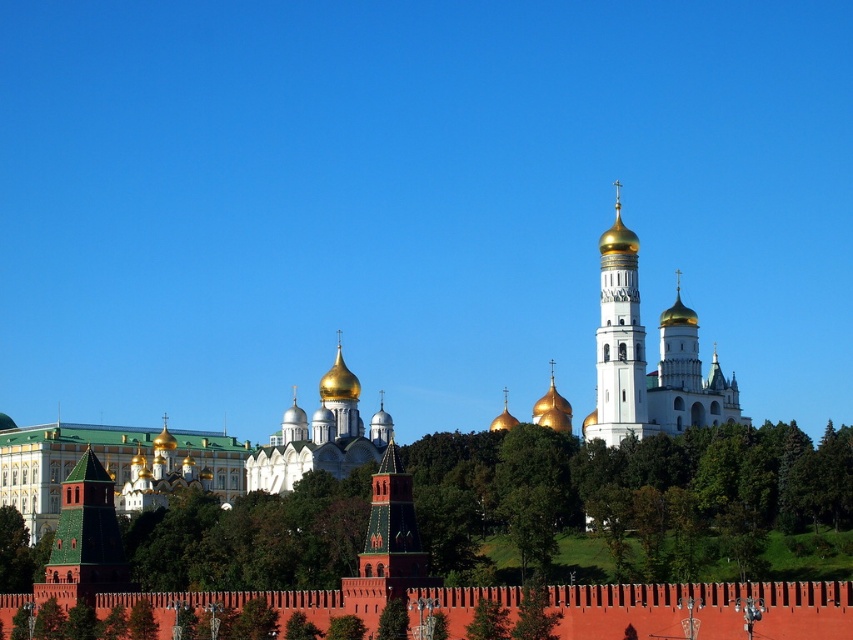
Is the position of green tiled tower at center less distant than that of green leafy tree at center?

That is False.

Does point (393, 492) lie in front of point (405, 616)?

No, it is not.

Find the location of a particular element. green tiled tower at center is located at coordinates click(393, 529).

Does point (61, 592) come behind point (404, 504)?

Yes, point (61, 592) is farther from viewer.

Is the position of green tiled tower at lower left more distant than that of green tiled tower at center?

Yes, green tiled tower at lower left is behind green tiled tower at center.

Between point (115, 522) and point (380, 493), which one is positioned behind?

The point (115, 522) is behind.

This screenshot has width=853, height=640. I want to click on green tiled tower at lower left, so click(85, 538).

The image size is (853, 640). I want to click on gold domed tower at center right, so click(x=618, y=340).

Between point (596, 397) and point (364, 554), which one is positioned in front?

Positioned in front is point (364, 554).

Identify the location of gold domed tower at center right. (618, 340).